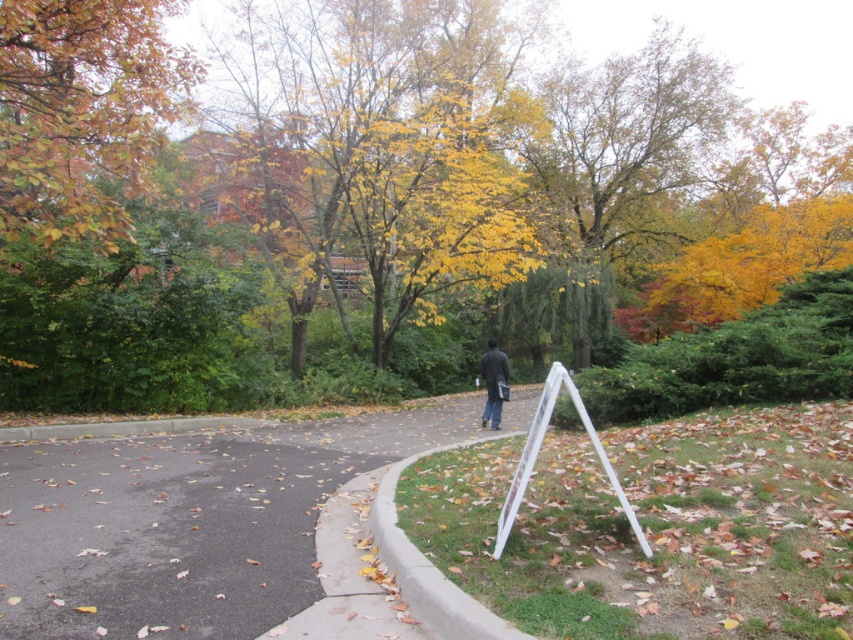
Which is below, asphalt road at center or dark gray jacket at center?

Positioned lower is asphalt road at center.

Is the position of asphalt road at center less distant than that of dark gray jacket at center?

Yes.

Between point (410, 433) and point (492, 376), which one is positioned in front?

Point (410, 433) is more forward.

Where is `asphalt road at center`? The height and width of the screenshot is (640, 853). asphalt road at center is located at coordinates 184,524.

Can you confirm if autumn leaves at upper left is positioned above dark gray jacket at center?

Yes.

Is autumn leaves at upper left to the left of dark gray jacket at center from the viewer's perspective?

Yes, autumn leaves at upper left is to the left of dark gray jacket at center.

Who is more distant from viewer, (165, 86) or (502, 358)?

The point (502, 358) is more distant.

Image resolution: width=853 pixels, height=640 pixels. What are the coordinates of `autumn leaves at upper left` in the screenshot? It's located at (82, 113).

Is asphalt road at center thinner than autumn leaves at upper left?

No.

Consider the image. Is asphalt road at center smaller than autumn leaves at upper left?

No.

Does point (242, 605) come farther from viewer compared to point (59, 122)?

No, it is in front of (59, 122).

Find the location of a particular element. The height and width of the screenshot is (640, 853). asphalt road at center is located at coordinates (184, 524).